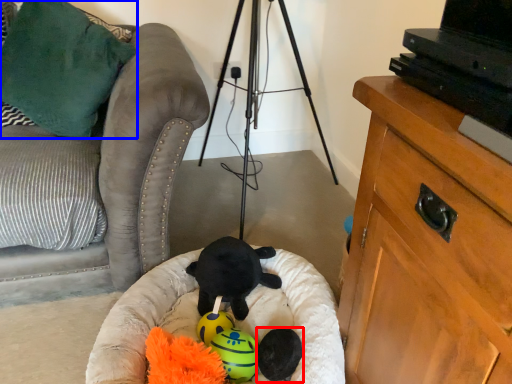
Question: Which object appears closest to the camera in this image, toy (highlighted by a red box) or pillow (highlighted by a blue box)?

Choices:
 (A) toy
 (B) pillow

Answer: (A)